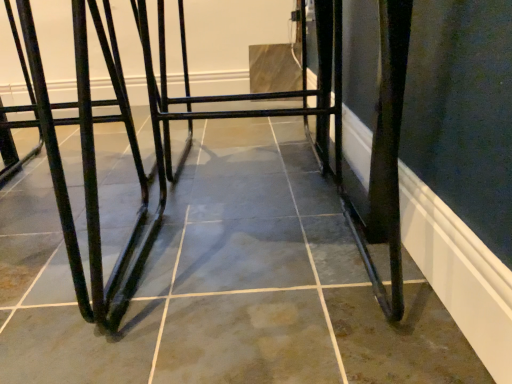
Question: From their relative heights in the image, would you say black metal table at center is taller or shorter than matte black metal bar stool at left?

Choices:
 (A) short
 (B) tall

Answer: (A)

Question: Considering their positions, is black metal table at center located in front of or behind matte black metal bar stool at left?

Choices:
 (A) behind
 (B) front

Answer: (B)

Question: From the image's perspective, is black metal table at center positioned above or below matte black metal bar stool at left?

Choices:
 (A) above
 (B) below

Answer: (A)

Question: Does point (84, 203) appear closer or farther from the camera than point (156, 221)?

Choices:
 (A) closer
 (B) farther

Answer: (B)

Question: Considering the positions of matte black metal bar stool at left and black metal table at center in the image, is matte black metal bar stool at left wider or thinner than black metal table at center?

Choices:
 (A) wide
 (B) thin

Answer: (A)

Question: In the image, is matte black metal bar stool at left positioned in front of or behind black metal table at center?

Choices:
 (A) front
 (B) behind

Answer: (B)

Question: From the image's perspective, is matte black metal bar stool at left located above or below black metal table at center?

Choices:
 (A) below
 (B) above

Answer: (A)